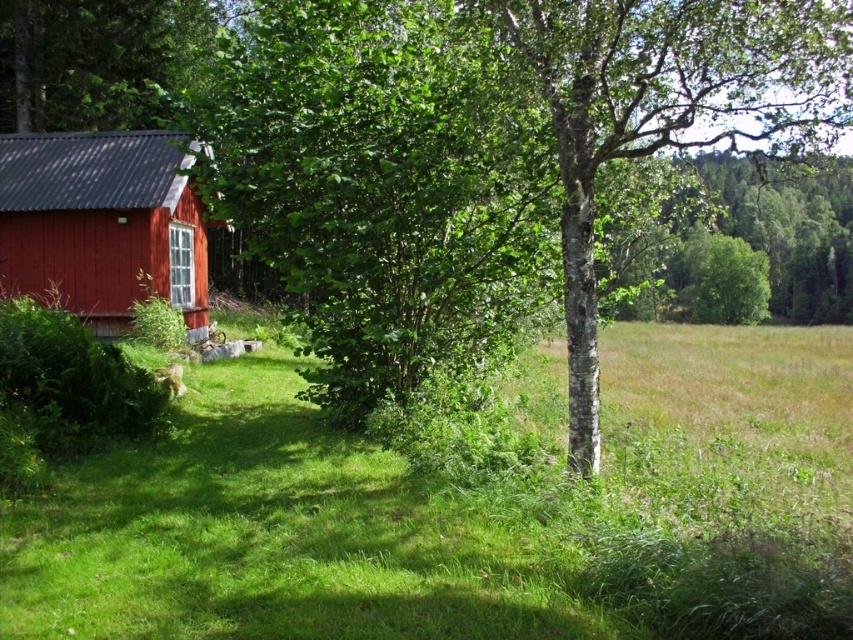
Question: Which object appears farthest from the camera in this image?

Choices:
 (A) green leafy tree at center
 (B) matte wooden barn at left

Answer: (B)

Question: Can you confirm if green grassy at lower left is positioned to the right of green leafy tree at upper left?

Choices:
 (A) yes
 (B) no

Answer: (A)

Question: Observing the image, what is the correct spatial positioning of green grassy at lower left in reference to matte wooden barn at left?

Choices:
 (A) left
 (B) right

Answer: (B)

Question: Which object is closer to the camera taking this photo?

Choices:
 (A) green leafy tree at upper left
 (B) green leafy tree at center
 (C) matte wooden barn at left
 (D) green grassy at lower left

Answer: (D)

Question: Which point is farther from the camera taking this photo?

Choices:
 (A) (387, 38)
 (B) (608, 460)
 (C) (21, 275)
 (D) (126, 115)

Answer: (D)

Question: Does green leafy tree at center have a lesser width compared to green leafy tree at upper left?

Choices:
 (A) no
 (B) yes

Answer: (A)